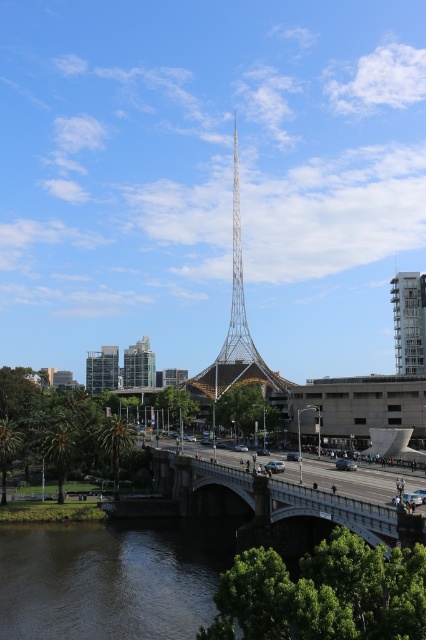
Question: Which of the following is the closest to the observer?

Choices:
 (A) white glass building at right
 (B) white stone bridge at center

Answer: (B)

Question: Does glassy modern building at center come behind glassy reflective building at left?

Choices:
 (A) yes
 (B) no

Answer: (A)

Question: Is metallic lattice tower at center positioned at the back of glassy modern building at center?

Choices:
 (A) no
 (B) yes

Answer: (A)

Question: Considering the real-world distances, which object is closest to the glassy reflective building at left?

Choices:
 (A) white glass building at right
 (B) white stone bridge at center

Answer: (A)

Question: Is metallic lattice tower at center to the right of glassy modern building at center from the viewer's perspective?

Choices:
 (A) no
 (B) yes

Answer: (B)

Question: Which point is farther to the camera?

Choices:
 (A) metallic lattice tower at center
 (B) white stone bridge at center
 (C) white glass building at right

Answer: (C)